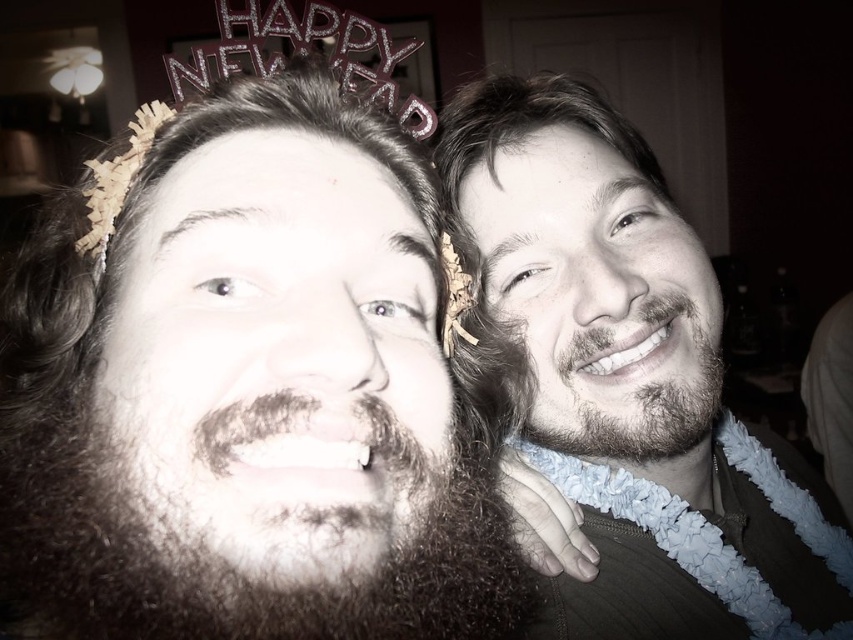
Based on the photo, you are taking a photo of two people standing in front of a door. You notice two points marked in the image. One is at position point (x=672, y=381) and the other at point (x=93, y=205). Which point is closer to the camera?

Point (x=93, y=205) is closer to the camera because point (x=672, y=381) is further away from the camera than point (x=93, y=205).

You are planning to take a photo with two friends. You see a sparkly silver crown at upper center and dark brown hair at upper right. Which object is positioned more to the left side of the image?

The sparkly silver crown at upper center is positioned more to the left side of the image than the dark brown hair at upper right.